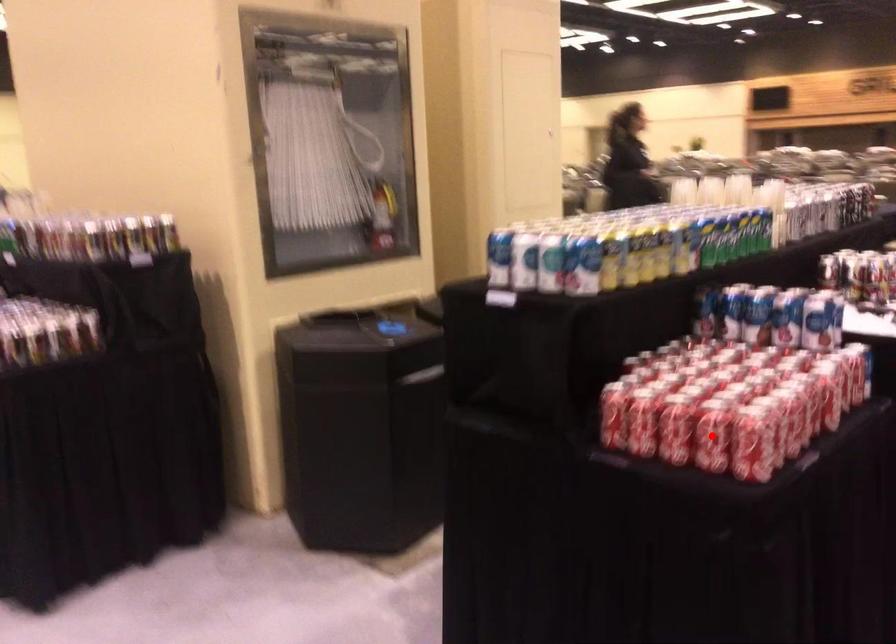
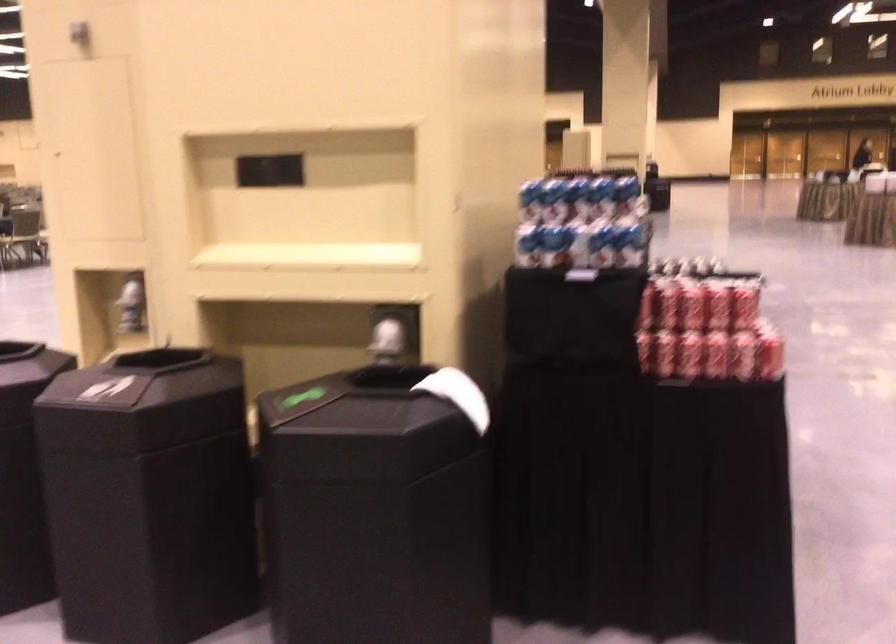
Question: I am providing you with two images of the same scene from different viewpoints. A red point is marked on the first image. Can you still see the location of the red point in image 2?

Choices:
 (A) Yes
 (B) No

Answer: (B)